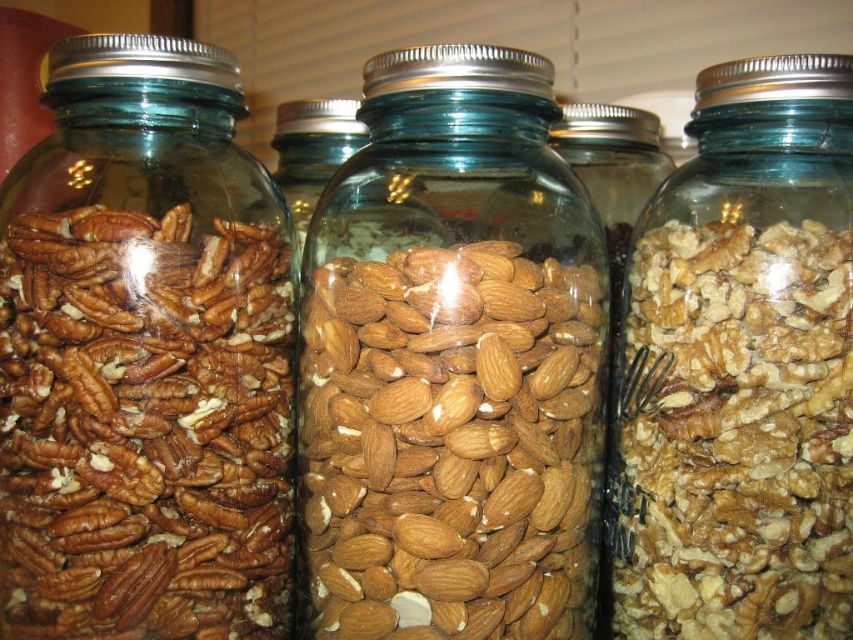
You are organizing a snack bar and need to arrange the jars so that the larger nuts are placed in front for visibility. Given the jars with brown matte pecans at left and brown textured nuts at center, which jar should you place in front?

The brown matte pecans at left should be placed in front because they are larger in size than the brown textured nuts at center, making them more visible to customers.

You are holding a ruler and want to measure the distance from your eyes to the brown matte pecans at left. If the ruler is 12 inches long, how many rulers do you need to reach that distance?

The distance to the brown matte pecans at left is 23.26 inches. Since the ruler is 12 inches long, you would need approximately 2 rulers to cover the distance, as 2 rulers would measure 24 inches, which is slightly more than the required 23.26 inches.